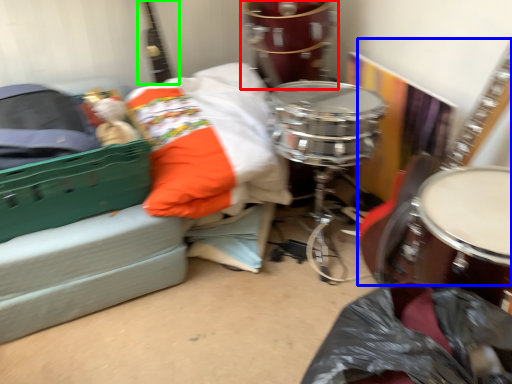
Question: Which is farther away from drum (highlighted by a red box)? guitar (highlighted by a blue box) or guitar (highlighted by a green box)?

Choices:
 (A) guitar
 (B) guitar

Answer: (A)